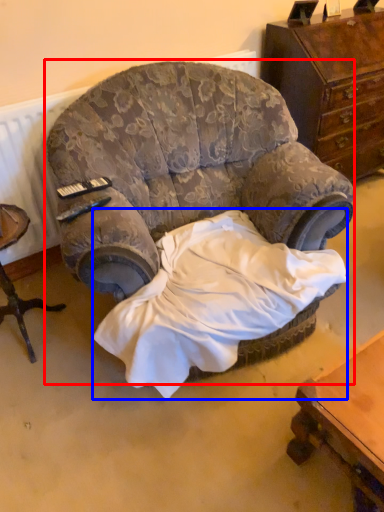
Question: Which point is further to the camera, chair (highlighted by a red box) or sheet (highlighted by a blue box)?

Choices:
 (A) chair
 (B) sheet

Answer: (B)